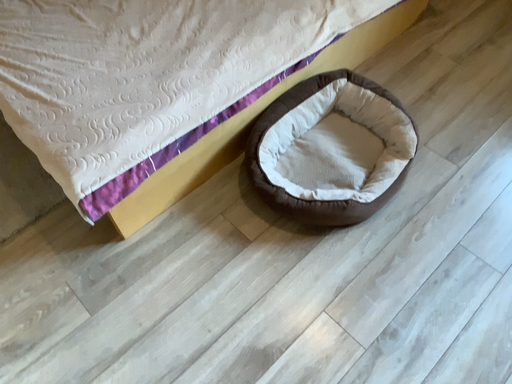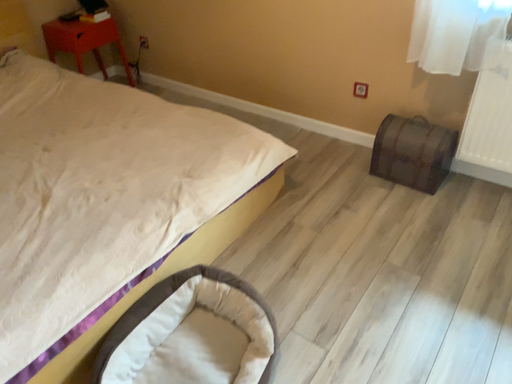
Question: How did the camera likely rotate when shooting the video?

Choices:
 (A) rotated upward
 (B) rotated downward

Answer: (A)